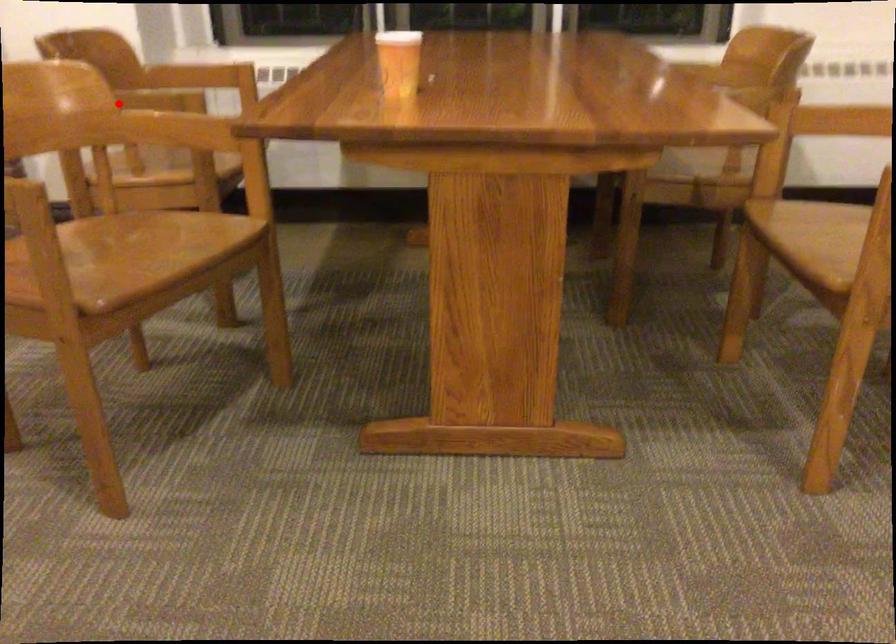
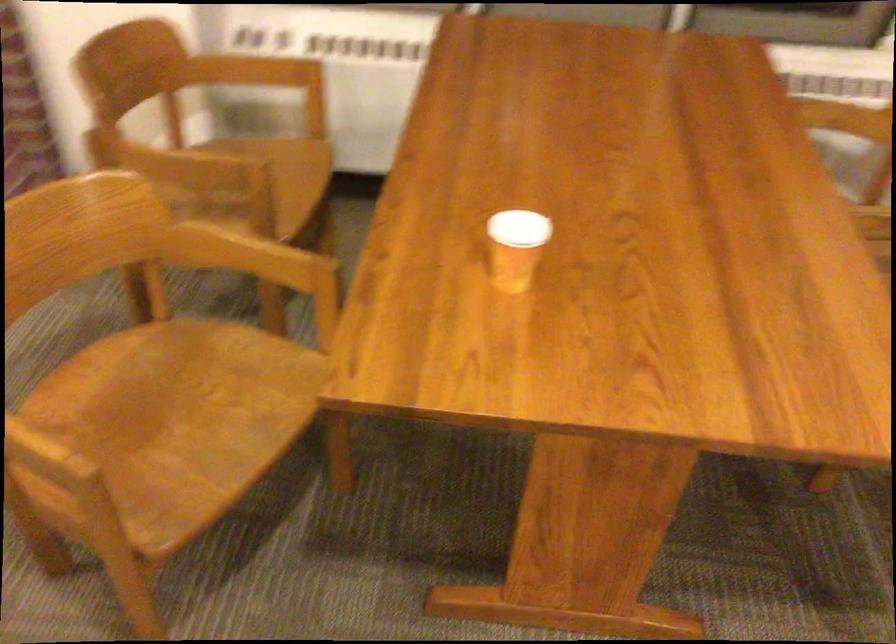
Question: I am providing you with two images of the same scene from different viewpoints. Image1 has a red point marked. In image2, the corresponding 3D location appears at what relative position? Reply with the corresponding letter.

Choices:
 (A) Closer
 (B) Farther

Answer: (A)